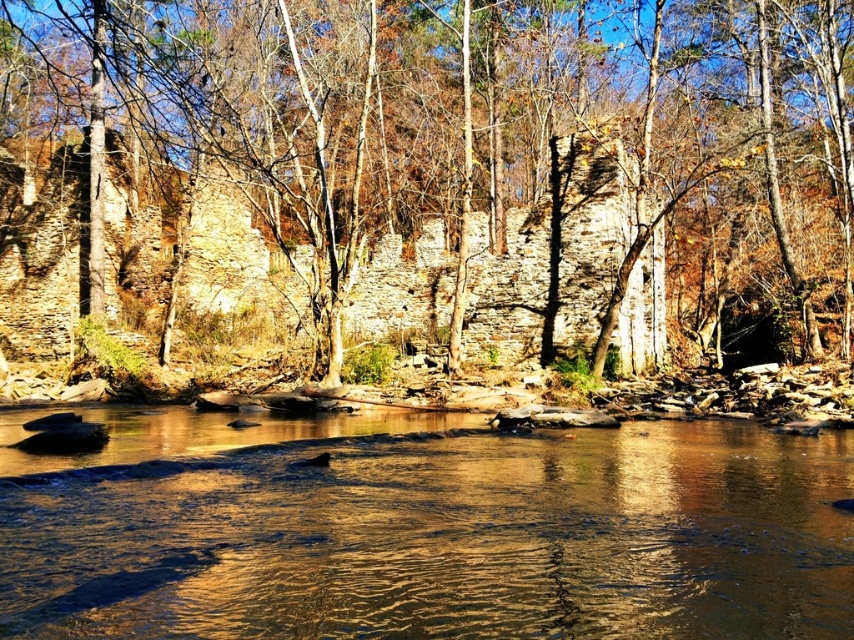
Who is more forward, (129, 26) or (1, 556)?

Point (1, 556) is in front.

Is point (852, 42) in front of point (148, 589)?

No, it is not.

Locate an element on the screen. smooth bark tree at center is located at coordinates (436, 170).

I want to click on smooth bark tree at center, so click(436, 170).